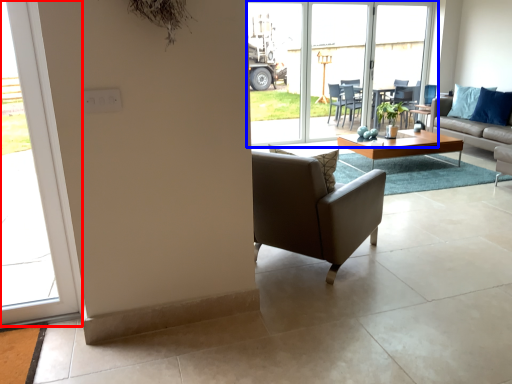
Question: Among these objects, which one is farthest to the camera, window (highlighted by a red box) or window (highlighted by a blue box)?

Choices:
 (A) window
 (B) window

Answer: (B)